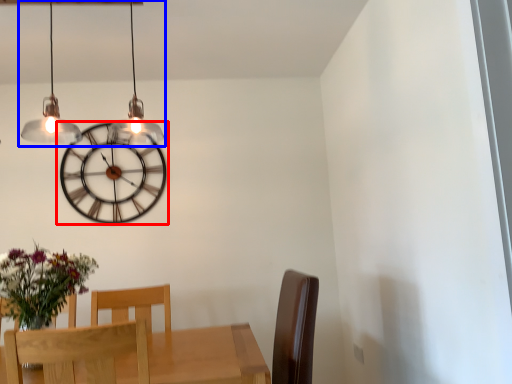
Question: Which point is closer to the camera, wall clock (highlighted by a red box) or lamp (highlighted by a blue box)?

Choices:
 (A) wall clock
 (B) lamp

Answer: (B)